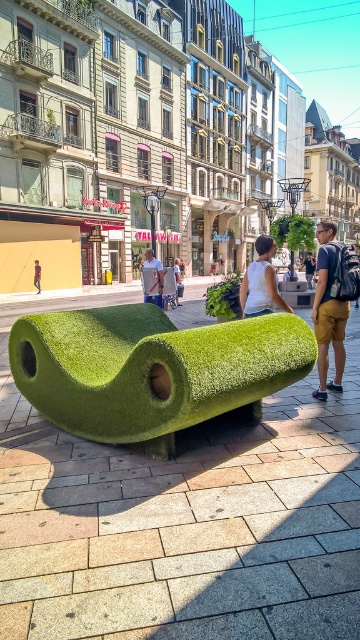
You are a city planner analyzing the layout of this urban space. There are two points marked in the image, point A at coordinates point (78, 401) and point B at coordinates point (146, 250). If you were to walk from the bench towards the buildings in the background, which point would you encounter first?

Point A at coordinates point (78, 401) is closer to the viewer than point B at coordinates point (146, 250). Therefore, you would encounter point A first as you walk towards the buildings.

You are a photographer holding a camera. You want to take a photo of the green grass bench at center from a distance where the bench fills the frame without being too close. Considering the bench is 2.20 meters away from your camera, is this distance suitable for capturing the bench in full without cropping?

The green grass bench at center and camera are 2.20 meters apart. This distance may be too close to capture the entire bench in the frame without cropping, as most cameras require a slightly farther distance to fit larger objects. Adjust your position to ensure the bench fits comfortably within the frame.